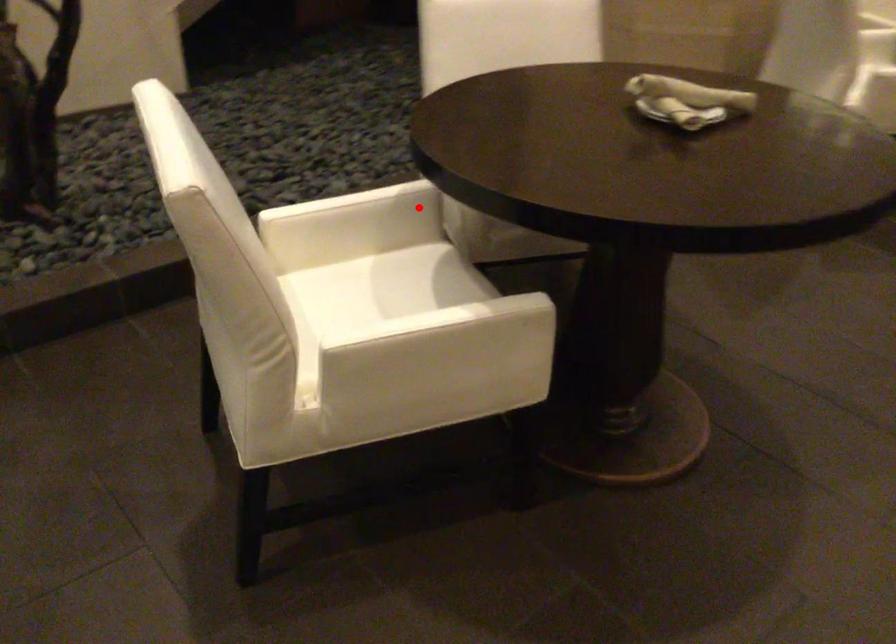
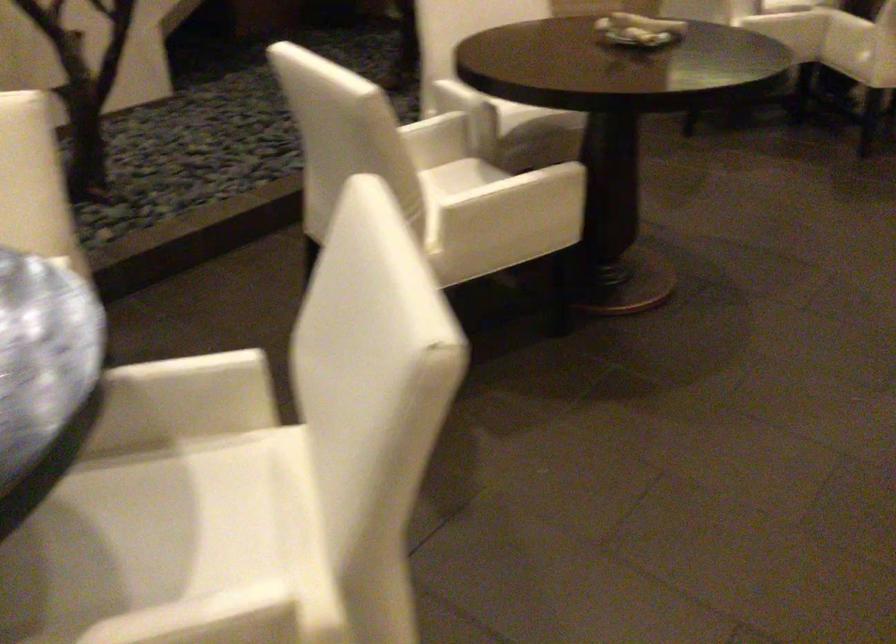
Question: I am providing you with two images of the same scene from different viewpoints. A red point is shown in image1. For the corresponding object point in image2, is it positioned nearer or farther from the camera?

Choices:
 (A) Nearer
 (B) Farther

Answer: (B)